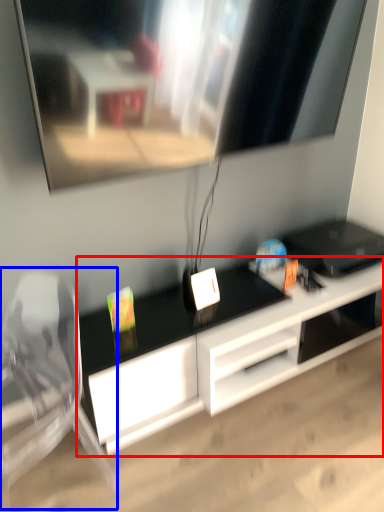
Question: Which of the following is the closest to the observer, desk (highlighted by a red box) or swivel chair (highlighted by a blue box)?

Choices:
 (A) desk
 (B) swivel chair

Answer: (B)